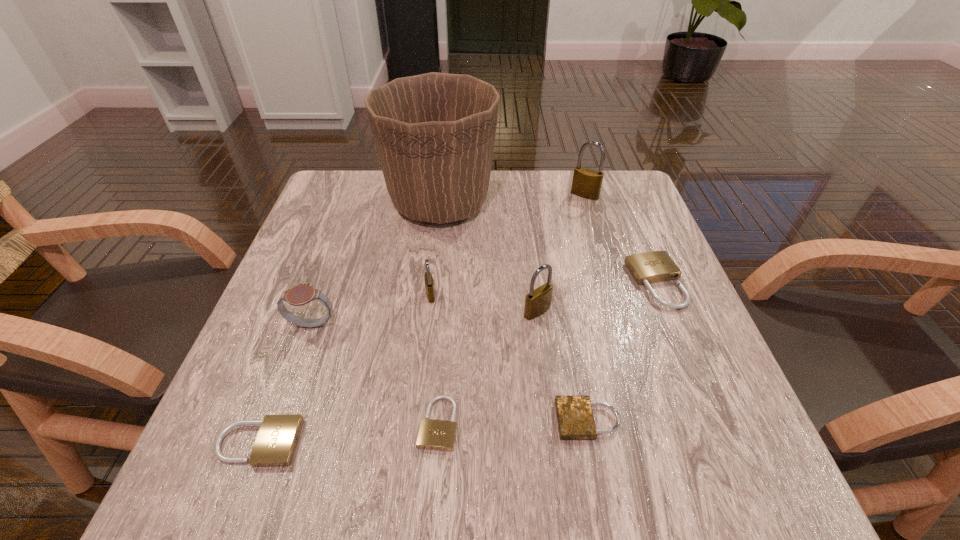
Locate an element on the screen. Image resolution: width=960 pixels, height=540 pixels. flowerpot is located at coordinates (434, 133).

I want to click on the farthest padlock, so [x=586, y=183].

Locate an element on the screen. the second padlock from right to left is located at coordinates (586, 183).

Where is `the second brass padlock from left to right`? This screenshot has height=540, width=960. the second brass padlock from left to right is located at coordinates (538, 301).

Identify the location of the second biggest brass padlock. (538, 301).

Where is `the leftmost brass padlock`? This screenshot has height=540, width=960. the leftmost brass padlock is located at coordinates (429, 283).

At what (x,y) coordinates should I click in order to perform the action: click on the fifth shortest padlock. Please return your answer as a coordinate pair (x, y). This screenshot has height=540, width=960. Looking at the image, I should click on (429, 283).

Image resolution: width=960 pixels, height=540 pixels. In order to click on watch in this screenshot , I will do (x=302, y=294).

Locate an element on the screen. Image resolution: width=960 pixels, height=540 pixels. the rightmost beige padlock is located at coordinates (657, 266).

Find the location of a particular element. the fourth tallest padlock is located at coordinates (657, 266).